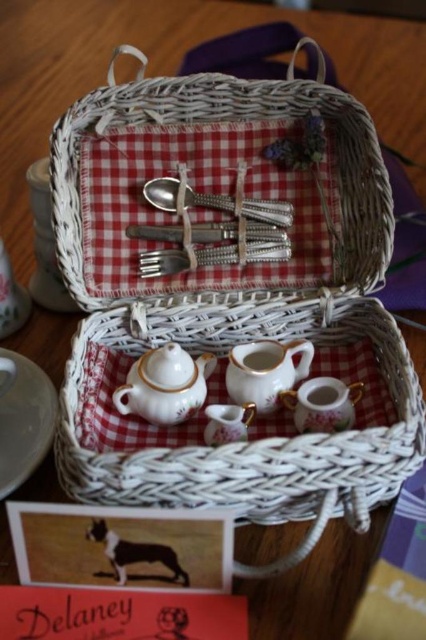
Question: Does matte porcelain teacup at lower right appear over matte porcelain teacup at center?

Choices:
 (A) no
 (B) yes

Answer: (A)

Question: Is white wicker basket at center behind porcelain teacup at lower center?

Choices:
 (A) yes
 (B) no

Answer: (B)

Question: Which object is positioned closest to the porcelain teacup at lower center?

Choices:
 (A) silver metallic spoon at center
 (B) matte porcelain teacup at lower right
 (C) white porcelain teapot at center

Answer: (B)

Question: Which of the following is the farthest from the observer?

Choices:
 (A) silver metallic spoon at center
 (B) white glossy saucer at lower left
 (C) matte porcelain teacup at lower right

Answer: (A)

Question: Which of the following is the closest to the observer?

Choices:
 (A) white porcelain teapot at center
 (B) porcelain teacup at lower center
 (C) matte porcelain teacup at center

Answer: (A)

Question: Can you confirm if porcelain teapot at center is bigger than white porcelain teapot at center?

Choices:
 (A) no
 (B) yes

Answer: (B)